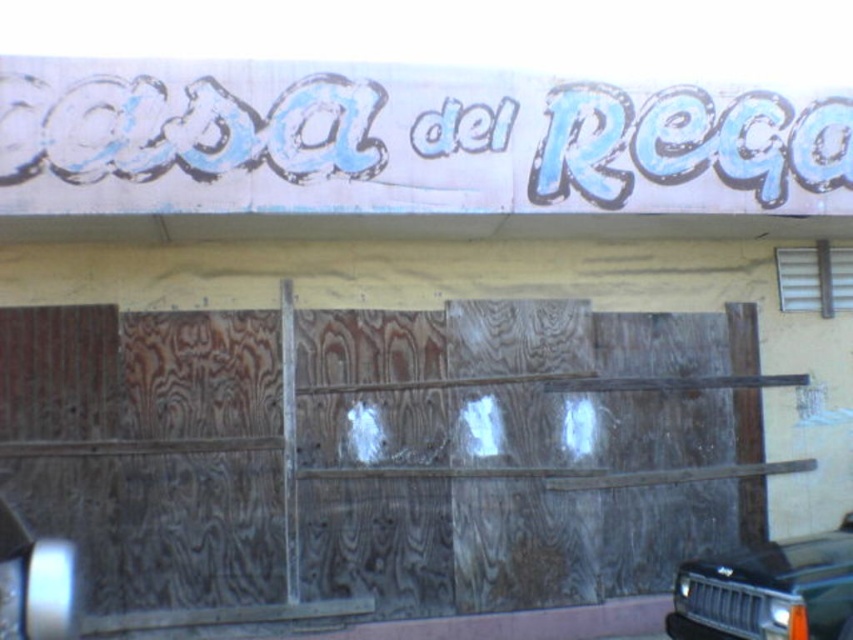
Does weathered wood garage door at center have a smaller size compared to black matte car at lower right?

No, weathered wood garage door at center is not smaller than black matte car at lower right.

Can you confirm if weathered wood garage door at center is positioned to the left of black matte car at lower right?

Correct, you'll find weathered wood garage door at center to the left of black matte car at lower right.

The width and height of the screenshot is (853, 640). What do you see at coordinates (373, 458) in the screenshot?
I see `weathered wood garage door at center` at bounding box center [373, 458].

Locate an element on the screen. weathered wood garage door at center is located at coordinates (373, 458).

Between blue painted sign at upper center and black matte car at lower right, which one has more height?

blue painted sign at upper center is taller.

Find the location of a particular element. The height and width of the screenshot is (640, 853). blue painted sign at upper center is located at coordinates (403, 141).

This screenshot has width=853, height=640. I want to click on blue painted sign at upper center, so click(x=403, y=141).

The image size is (853, 640). What are the coordinates of `blue painted sign at upper center` in the screenshot? It's located at (403, 141).

Is weathered wood garage door at center below blue painted sign at upper center?

Indeed, weathered wood garage door at center is positioned under blue painted sign at upper center.

Does point (469, 586) come in front of point (27, 134)?

No, it is not.

Where is `weathered wood garage door at center`? weathered wood garage door at center is located at coordinates (373, 458).